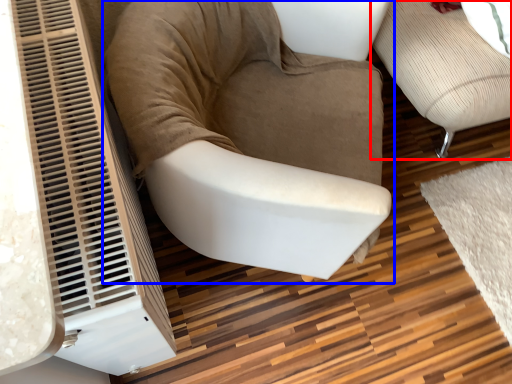
Question: Among these objects, which one is farthest to the camera, furniture (highlighted by a red box) or chair (highlighted by a blue box)?

Choices:
 (A) furniture
 (B) chair

Answer: (A)